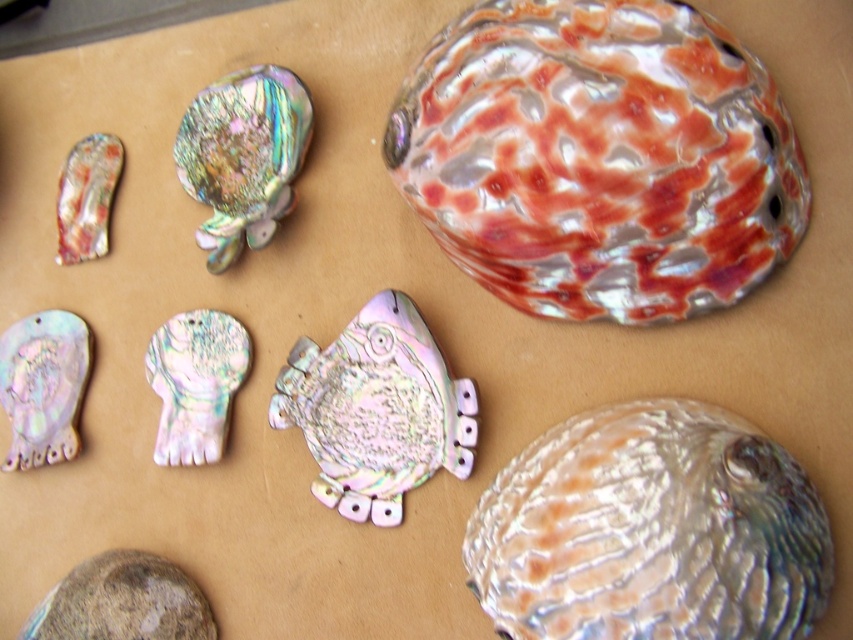
Question: Considering the real-world distances, which object is closest to the multicolored iridescent shell at upper right?

Choices:
 (A) speckled stone at bottom left
 (B) iridescent pearl shell at lower left

Answer: (A)

Question: Which point appears farthest from the camera in this image?

Choices:
 (A) (248, 70)
 (B) (733, 524)
 (C) (387, 381)

Answer: (A)

Question: Does multicolored iridescent shell at upper right appear under iridescent pearl shell at lower left?

Choices:
 (A) yes
 (B) no

Answer: (B)

Question: Can you confirm if speckled stone at bottom left is thinner than iridescent pearl shell at lower left?

Choices:
 (A) no
 (B) yes

Answer: (A)

Question: Estimate the real-world distances between objects in this image. Which object is closer to the iridescent mother-of-pearl fish at center?

Choices:
 (A) speckled stone at bottom left
 (B) iridescent shell at center
 (C) iridescent shell at upper left

Answer: (B)

Question: Where is speckled stone at bottom left located in relation to iridescent shell at center in the image?

Choices:
 (A) left
 (B) right

Answer: (A)